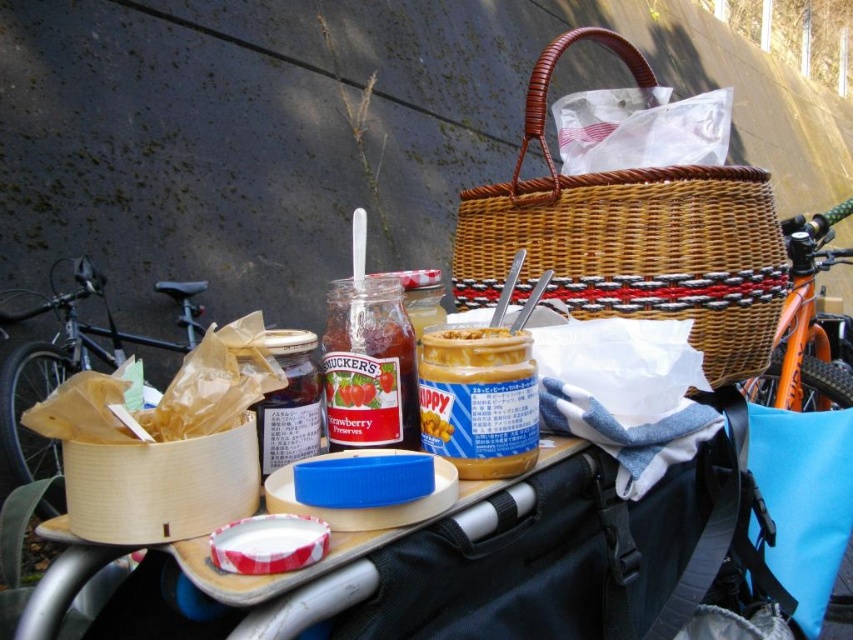
Does woven brown basket at upper center have a smaller size compared to peanut butter jar at center?

No.

Measure the distance from woven brown basket at upper center to peanut butter jar at center.

woven brown basket at upper center and peanut butter jar at center are 13.82 inches apart from each other.

Image resolution: width=853 pixels, height=640 pixels. I want to click on woven brown basket at upper center, so pyautogui.click(x=631, y=237).

Find the location of a particular element. woven brown basket at upper center is located at coordinates (631, 237).

Between woven brown basket at upper center and smooth creamy peanut butter at center, which one is positioned higher?

woven brown basket at upper center is higher up.

Where is `woven brown basket at upper center`? woven brown basket at upper center is located at coordinates (631, 237).

Who is shorter, woven brown basket at upper center or orange matte bicycle at upper right?

Standing shorter between the two is woven brown basket at upper center.

Where is `woven brown basket at upper center`? Image resolution: width=853 pixels, height=640 pixels. woven brown basket at upper center is located at coordinates (631, 237).